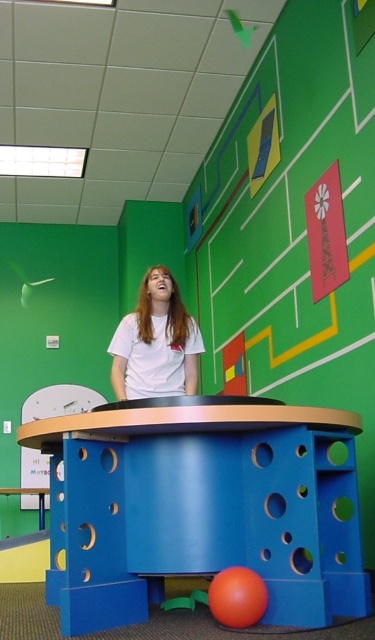
Question: Does matte green bulletin board at upper center have a smaller size compared to white matte shirt at center?

Choices:
 (A) yes
 (B) no

Answer: (B)

Question: Considering the real-world distances, which object is closest to the white matte shirt at center?

Choices:
 (A) matte green bulletin board at upper center
 (B) blue matte table at center

Answer: (B)

Question: Can you confirm if blue matte table at center is bigger than white matte shirt at center?

Choices:
 (A) no
 (B) yes

Answer: (B)

Question: Which is farther from the white matte shirt at center?

Choices:
 (A) matte green bulletin board at upper center
 (B) blue matte table at center

Answer: (A)

Question: Can you confirm if blue matte table at center is positioned to the left of matte green bulletin board at upper center?

Choices:
 (A) yes
 (B) no

Answer: (A)

Question: Which of these objects is positioned farthest from the matte green bulletin board at upper center?

Choices:
 (A) blue matte table at center
 (B) white matte shirt at center

Answer: (A)